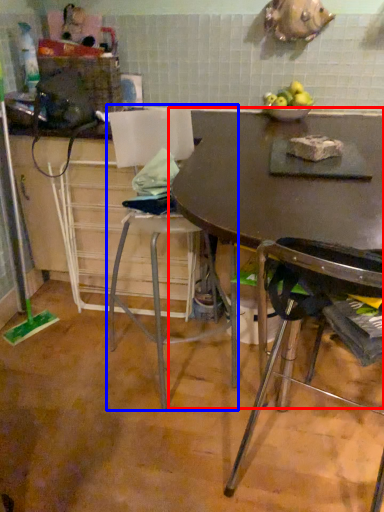
Question: Which object appears farthest to the camera in this image, table (highlighted by a red box) or chair (highlighted by a blue box)?

Choices:
 (A) table
 (B) chair

Answer: (B)